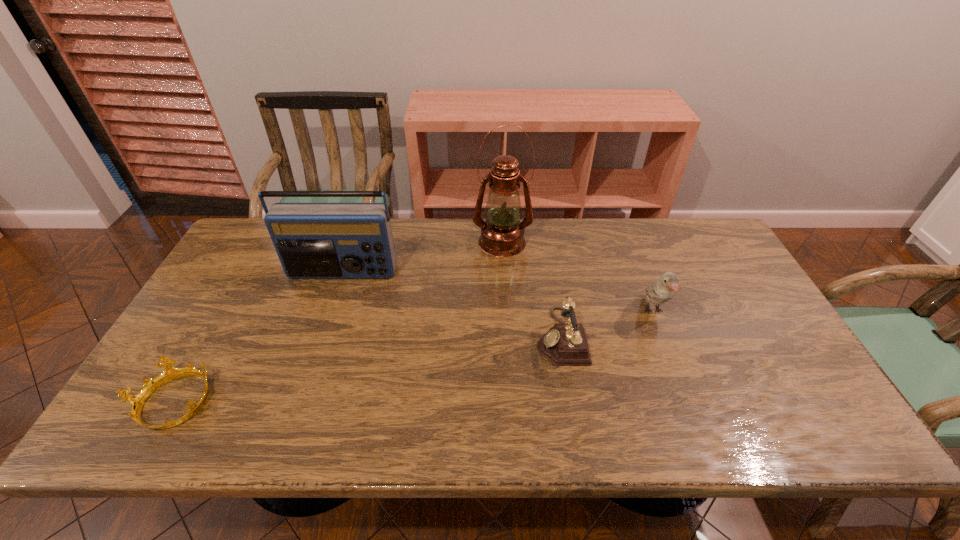
This screenshot has width=960, height=540. Find the location of `vacant point located between the second farthest object and the oil lamp`. vacant point located between the second farthest object and the oil lamp is located at coordinates (422, 258).

Where is `free space between the second tallest object and the tallest object`? free space between the second tallest object and the tallest object is located at coordinates (422, 258).

Locate an element on the screen. free spot between the telephone and the second tallest object is located at coordinates (452, 305).

This screenshot has height=540, width=960. What are the coordinates of `vacant space that's between the tallest object and the second tallest object` in the screenshot? It's located at (422, 258).

Identify the location of free spot between the fourth tallest object and the nearest object. (367, 370).

You are a GUI agent. You are given a task and a screenshot of the screen. Output one action in this format:
    pyautogui.click(x=<x>, y=<y>)
    Task: Click on the free space between the telephone and the fourth object from right to left
    
    Given the screenshot: What is the action you would take?
    pyautogui.click(x=452, y=305)

Where is `object that is the second nearest to the telephone`? This screenshot has width=960, height=540. object that is the second nearest to the telephone is located at coordinates (502, 235).

This screenshot has width=960, height=540. Find the location of `object that ranks as the third closest to the nearest object`. object that ranks as the third closest to the nearest object is located at coordinates (564, 344).

This screenshot has height=540, width=960. I want to click on vacant space that satisfies the following two spatial constraints: 1. on the dial of the telephone; 2. on the front side of the leftmost object, so click(572, 403).

You are a GUI agent. You are given a task and a screenshot of the screen. Output one action in this format:
    pyautogui.click(x=<x>, y=<y>)
    Task: Click on the free location that satisfies the following two spatial constraints: 1. at the face of the third tallest object; 2. on the dial of the telephone
    Image resolution: width=960 pixels, height=540 pixels.
    Given the screenshot: What is the action you would take?
    pyautogui.click(x=662, y=336)